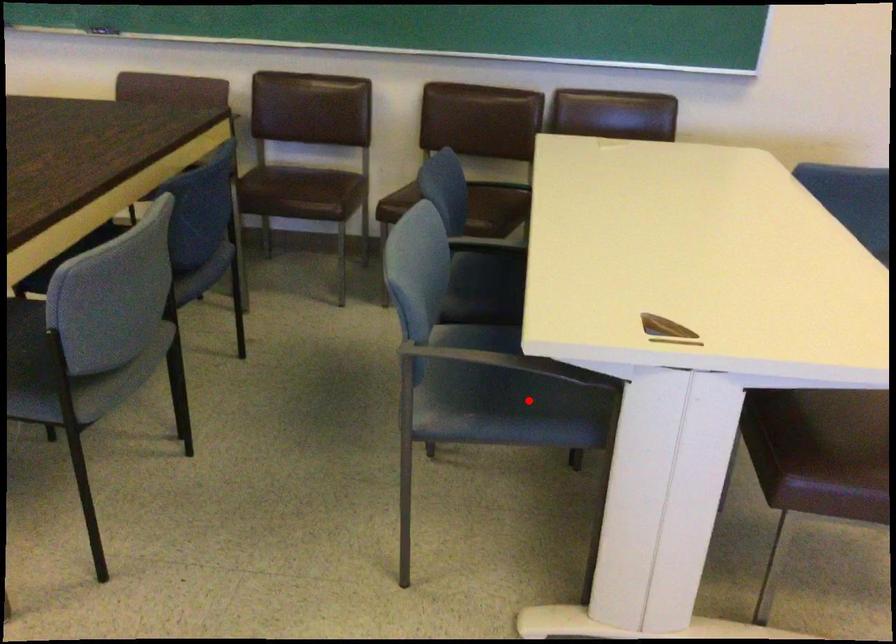
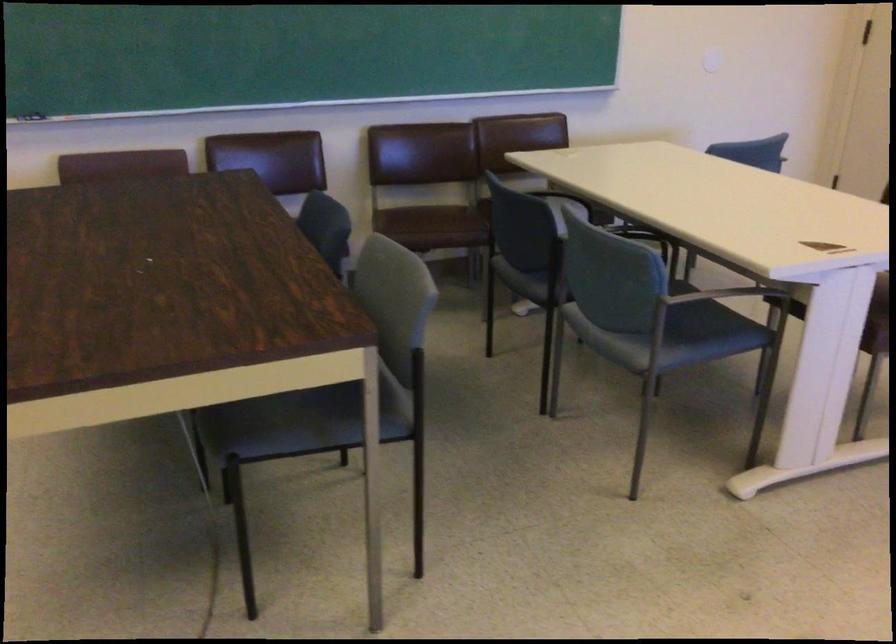
Question: I am providing you with two images of the same scene from different viewpoints. In image1, a red point is highlighted. Considering the same 3D point in image2, which of the following is correct?

Choices:
 (A) It is closer
 (B) It is farther

Answer: (B)